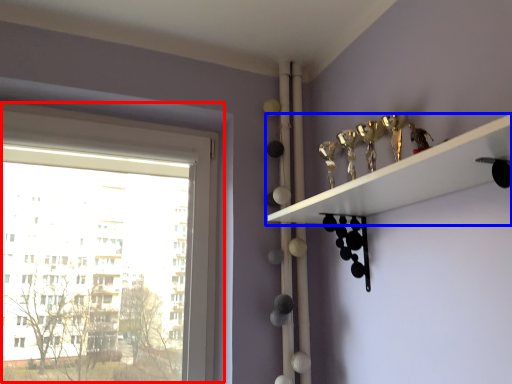
Question: Which object appears closest to the camera in this image, window (highlighted by a red box) or shelf (highlighted by a blue box)?

Choices:
 (A) window
 (B) shelf

Answer: (B)